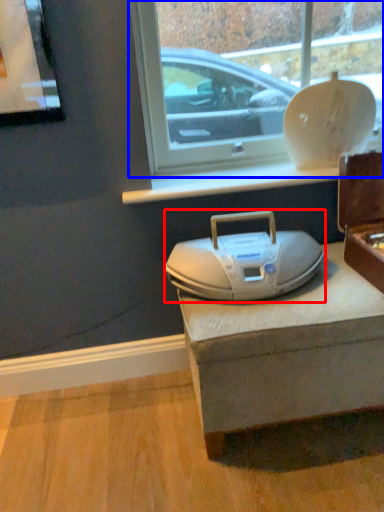
Question: Which of the following is the farthest to the observer, appliance (highlighted by a red box) or window (highlighted by a blue box)?

Choices:
 (A) appliance
 (B) window

Answer: (B)